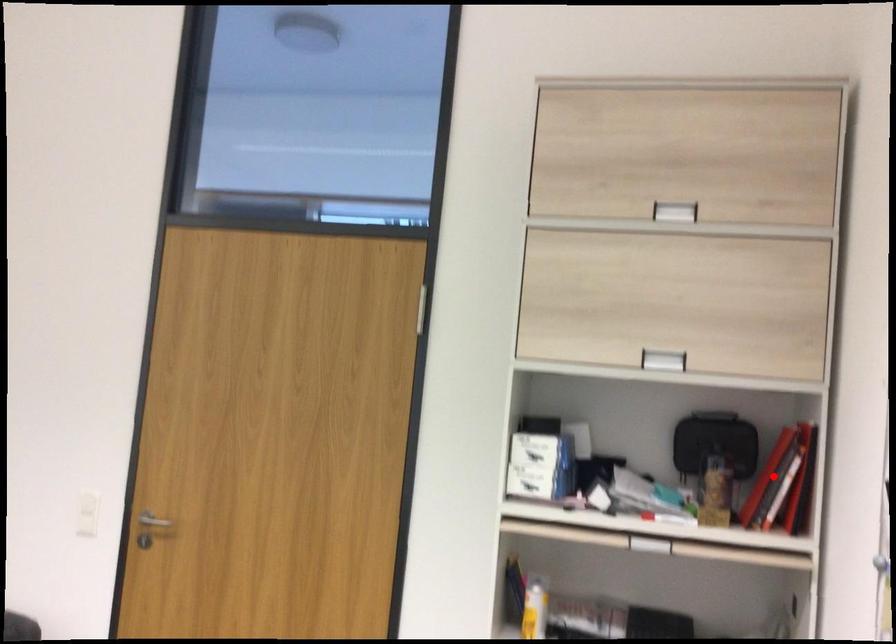
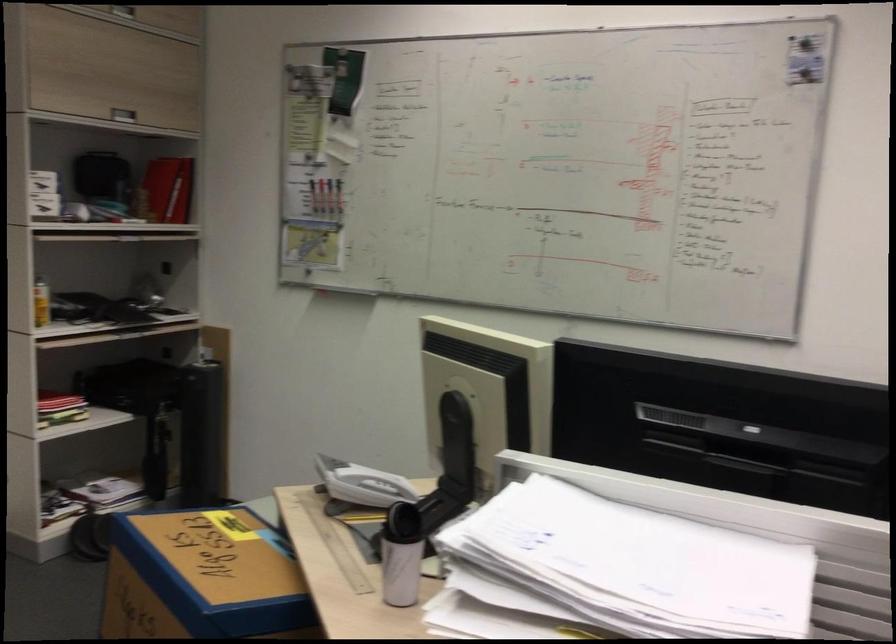
Question: I am providing you with two images of the same scene from different viewpoints. In image1, a red point is highlighted. Considering the same 3D point in image2, which of the following is correct?

Choices:
 (A) It is closer
 (B) It is farther

Answer: (B)